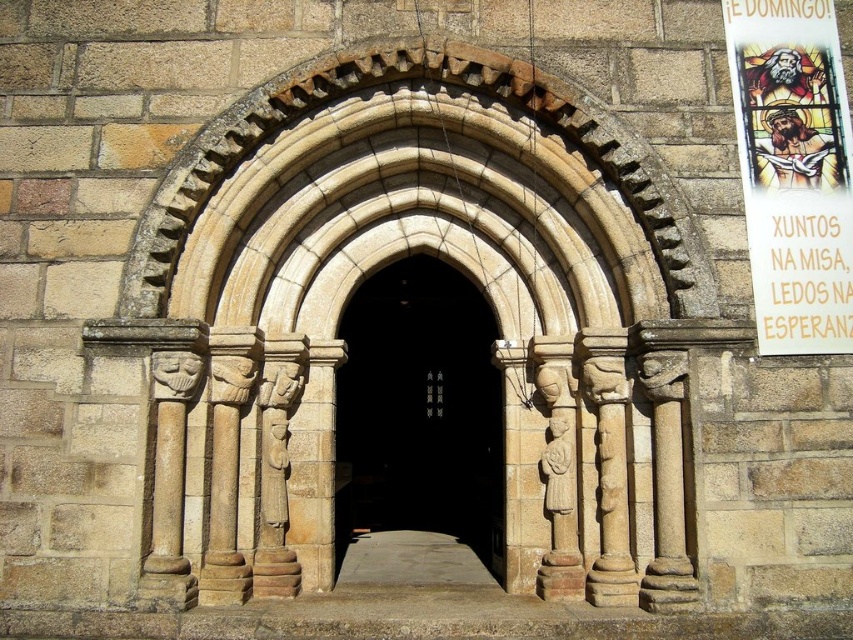
Question: Is smooth stone arch at center above white paper poster at upper right?

Choices:
 (A) no
 (B) yes

Answer: (A)

Question: Which point is closer to the camera taking this photo?

Choices:
 (A) (447, 360)
 (B) (741, 4)

Answer: (B)

Question: Which point is closer to the camera?

Choices:
 (A) smooth stone arch at center
 (B) white paper poster at upper right

Answer: (B)

Question: From the image, what is the correct spatial relationship of smooth stone arch at center in relation to white paper poster at upper right?

Choices:
 (A) left
 (B) right

Answer: (A)

Question: Can you confirm if smooth stone arch at center is positioned to the right of white paper poster at upper right?

Choices:
 (A) no
 (B) yes

Answer: (A)

Question: Among these points, which one is nearest to the camera?

Choices:
 (A) (805, 113)
 (B) (415, 525)

Answer: (A)